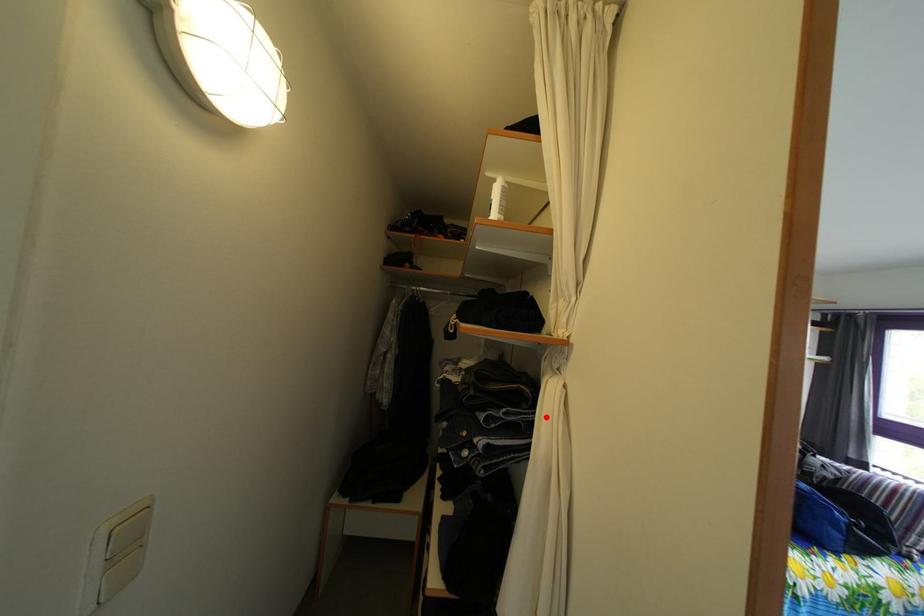
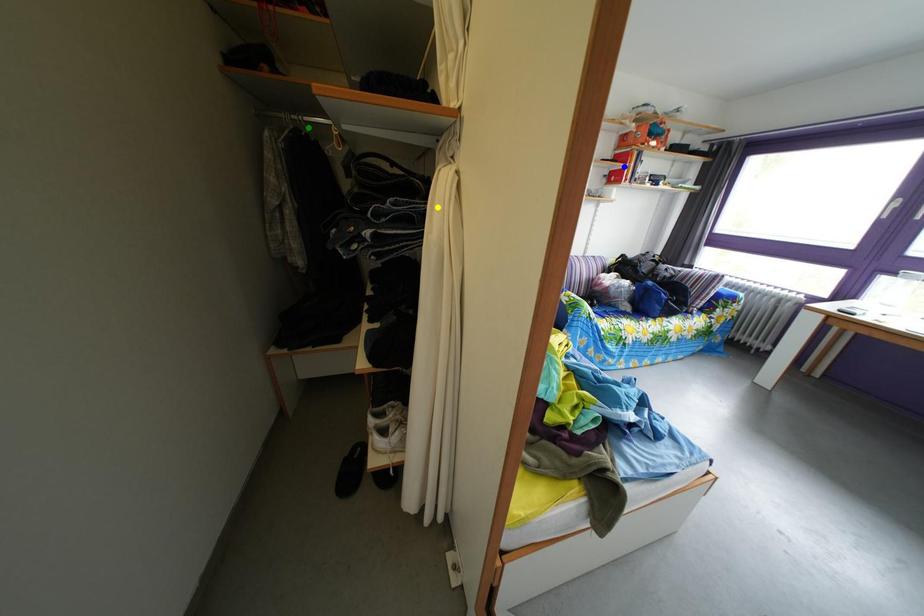
Question: I am providing you with two images of the same scene from different viewpoints. A red point is marked on the first image. You are given multiple points on the second image. Which point in image 2 is actually the same real-world point as the red point in image 1?

Choices:
 (A) yellow point
 (B) blue point
 (C) green point

Answer: (A)